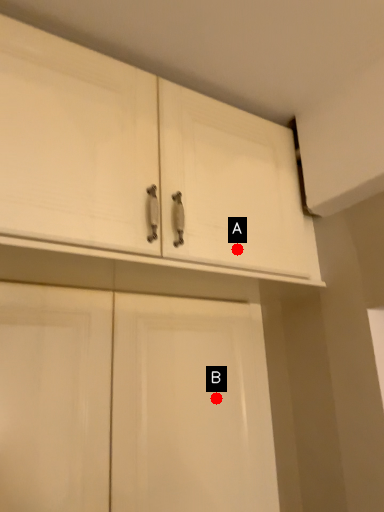
Question: Two points are circled on the image, labeled by A and B beside each circle. Which point appears closest to the camera in this image?

Choices:
 (A) A is closer
 (B) B is closer

Answer: (A)